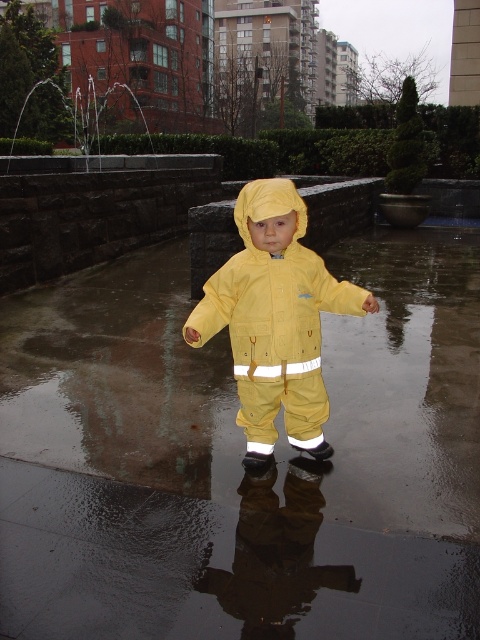
Question: Which point is farther to the camera?

Choices:
 (A) (432, 624)
 (B) (273, 401)

Answer: (B)

Question: Which of the following is the closest to the observer?

Choices:
 (A) yellow matte rain suit at center
 (B) glossy concrete pavement at center

Answer: (B)

Question: Does glossy concrete pavement at center have a lesser width compared to yellow matte rain suit at center?

Choices:
 (A) no
 (B) yes

Answer: (A)

Question: Is glossy concrete pavement at center in front of yellow matte rain suit at center?

Choices:
 (A) yes
 (B) no

Answer: (A)

Question: Can you confirm if glossy concrete pavement at center is positioned above yellow matte rain suit at center?

Choices:
 (A) no
 (B) yes

Answer: (A)